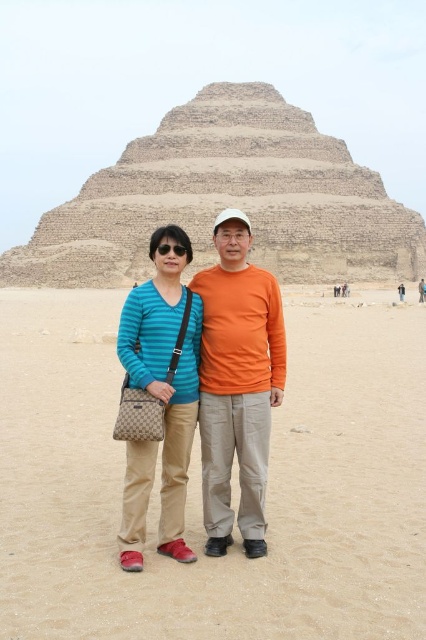
Which is in front, point (25, 616) or point (281, 301)?

Point (25, 616) is more forward.

Between point (374, 420) and point (244, 394), which one is positioned behind?

The point (374, 420) is more distant.

Which is behind, point (227, 604) or point (270, 342)?

Positioned behind is point (270, 342).

Find the location of a particular element. This screenshot has height=640, width=426. beige sand at center is located at coordinates (199, 483).

Looking at this image, is sandstone pyramid at center behind orange cotton shirt at center?

Yes, sandstone pyramid at center is behind orange cotton shirt at center.

Does sandstone pyramid at center come in front of orange cotton shirt at center?

That is False.

The height and width of the screenshot is (640, 426). Find the location of `sandstone pyramid at center`. sandstone pyramid at center is located at coordinates (227, 200).

Consider the image. Who is more distant from viewer, [368,198] or [150,428]?

Point [368,198]

Is sandstone pyramid at center taller than matte blue striped shirt at center?

Yes.

Which is in front, point (330, 221) or point (143, 518)?

Point (143, 518)

The width and height of the screenshot is (426, 640). In order to click on sandstone pyramid at center in this screenshot , I will do `click(227, 200)`.